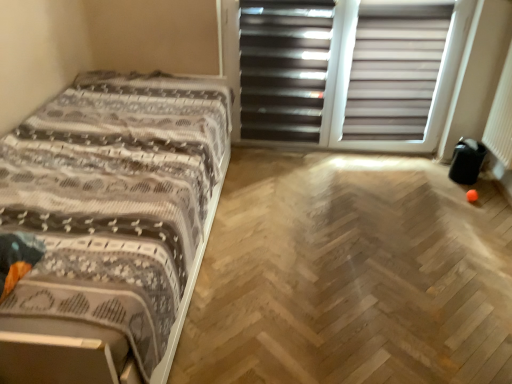
The width and height of the screenshot is (512, 384). Find the location of `matte white blinds at upper right`. matte white blinds at upper right is located at coordinates (394, 71).

Image resolution: width=512 pixels, height=384 pixels. Describe the element at coordinates (283, 68) in the screenshot. I see `black matte screen door at upper center, the 1th screen door positioned from the left` at that location.

In order to face patterned fabric bed at left, should I rotate leftwards or rightwards?

Rotate left and turn 18.602 degrees.

Measure the distance between point (149, 378) and camera.

Point (149, 378) and camera are 1.27 meters apart.

Image resolution: width=512 pixels, height=384 pixels. What do you see at coordinates (348, 72) in the screenshot? I see `white plastic blinds at upper center, arranged as the first screen door when viewed from the right` at bounding box center [348, 72].

The height and width of the screenshot is (384, 512). I want to click on matte white blinds at upper right, so click(394, 71).

Is patterned fabric bed at left aimed at matte white blinds at upper right?

No, patterned fabric bed at left is not aimed at matte white blinds at upper right.

Would you say patterned fabric bed at left is inside or outside matte white blinds at upper right?

patterned fabric bed at left is not inside matte white blinds at upper right, it's outside.

Considering the sizes of objects patterned fabric bed at left and matte white blinds at upper right in the image provided, who is wider, patterned fabric bed at left or matte white blinds at upper right?

patterned fabric bed at left is wider.

From a real-world perspective, is patterned fabric bed at left below matte white blinds at upper right?

Yes.

Is white plastic blinds at upper center, arranged as the first screen door when viewed from the right, to the left or to the right of black matte screen door at upper center, the 1th screen door positioned from the left, in the image?

white plastic blinds at upper center, arranged as the first screen door when viewed from the right, is to the right of black matte screen door at upper center, the 1th screen door positioned from the left.

From the image's perspective, is white plastic blinds at upper center, arranged as the first screen door when viewed from the right, below black matte screen door at upper center, which ranks as the 2th screen door in right-to-left order?

Yes.

Considering the sizes of objects white plastic blinds at upper center, the 2th screen door when ordered from left to right, and black matte screen door at upper center, which ranks as the 2th screen door in right-to-left order, in the image provided, who is shorter, white plastic blinds at upper center, the 2th screen door when ordered from left to right, or black matte screen door at upper center, which ranks as the 2th screen door in right-to-left order,?

With less height is black matte screen door at upper center, which ranks as the 2th screen door in right-to-left order.

Is white plastic blinds at upper center, arranged as the first screen door when viewed from the right, bigger than black matte screen door at upper center, the 1th screen door positioned from the left?

Yes, white plastic blinds at upper center, arranged as the first screen door when viewed from the right, is bigger than black matte screen door at upper center, the 1th screen door positioned from the left.

The image size is (512, 384). I want to click on window located above the patterned fabric bed at left (from a real-world perspective), so click(394, 71).

Is matte white blinds at upper right facing away from patterned fabric bed at left?

No, matte white blinds at upper right's orientation is not away from patterned fabric bed at left.

Based on the photo, which object is positioned more to the right, matte white blinds at upper right or patterned fabric bed at left?

matte white blinds at upper right is more to the right.

From the image's perspective, does matte white blinds at upper right appear lower than patterned fabric bed at left?

No, from the image's perspective, matte white blinds at upper right is not beneath patterned fabric bed at left.

Who is smaller, black matte screen door at upper center, which ranks as the 2th screen door in right-to-left order, or patterned fabric bed at left?

Smaller between the two is black matte screen door at upper center, which ranks as the 2th screen door in right-to-left order.

From a real-world perspective, between black matte screen door at upper center, the 1th screen door positioned from the left, and patterned fabric bed at left, who is vertically lower?

patterned fabric bed at left, from a real-world perspective.

Is black matte screen door at upper center, the 1th screen door positioned from the left, shorter than patterned fabric bed at left?

In fact, black matte screen door at upper center, the 1th screen door positioned from the left, may be taller than patterned fabric bed at left.

From the picture: Could you measure the distance between black matte screen door at upper center, which ranks as the 2th screen door in right-to-left order, and patterned fabric bed at left?

They are 37.93 inches apart.

From the picture: Is patterned fabric bed at left completely or partially outside of black matte screen door at upper center, which ranks as the 2th screen door in right-to-left order?

Absolutely, patterned fabric bed at left is external to black matte screen door at upper center, which ranks as the 2th screen door in right-to-left order.

Can you see patterned fabric bed at left touching black matte screen door at upper center, which ranks as the 2th screen door in right-to-left order?

No, patterned fabric bed at left is not next to black matte screen door at upper center, which ranks as the 2th screen door in right-to-left order.

From the image's perspective, who appears lower, patterned fabric bed at left or black matte screen door at upper center, the 1th screen door positioned from the left?

patterned fabric bed at left is shown below in the image.

Is patterned fabric bed at left oriented away from white plastic blinds at upper center, arranged as the first screen door when viewed from the right?

No, patterned fabric bed at left is not facing the opposite direction of white plastic blinds at upper center, arranged as the first screen door when viewed from the right.

Is patterned fabric bed at left next to white plastic blinds at upper center, the 2th screen door when ordered from left to right?

No, patterned fabric bed at left is not in contact with white plastic blinds at upper center, the 2th screen door when ordered from left to right.

How different are the orientations of patterned fabric bed at left and white plastic blinds at upper center, arranged as the first screen door when viewed from the right, in degrees?

The angular difference between patterned fabric bed at left and white plastic blinds at upper center, arranged as the first screen door when viewed from the right, is 1.65 degrees.

Considering the positions of objects patterned fabric bed at left and white plastic blinds at upper center, arranged as the first screen door when viewed from the right, in the image provided, who is more to the right, patterned fabric bed at left or white plastic blinds at upper center, arranged as the first screen door when viewed from the right,?

white plastic blinds at upper center, arranged as the first screen door when viewed from the right, is more to the right.

Is black matte screen door at upper center, the 1th screen door positioned from the left, in front of or behind white plastic blinds at upper center, arranged as the first screen door when viewed from the right, in the image?

black matte screen door at upper center, the 1th screen door positioned from the left, is behind white plastic blinds at upper center, arranged as the first screen door when viewed from the right.

Considering the points (270, 67) and (263, 128), which point is behind, point (270, 67) or point (263, 128)?

The point (263, 128) is more distant.

Considering the sizes of black matte screen door at upper center, which ranks as the 2th screen door in right-to-left order, and white plastic blinds at upper center, the 2th screen door when ordered from left to right, in the image, is black matte screen door at upper center, which ranks as the 2th screen door in right-to-left order, wider or thinner than white plastic blinds at upper center, the 2th screen door when ordered from left to right,?

In the image, black matte screen door at upper center, which ranks as the 2th screen door in right-to-left order, appears to be wider than white plastic blinds at upper center, the 2th screen door when ordered from left to right.

How distant is black matte screen door at upper center, which ranks as the 2th screen door in right-to-left order, from white plastic blinds at upper center, arranged as the first screen door when viewed from the right?

The distance of black matte screen door at upper center, which ranks as the 2th screen door in right-to-left order, from white plastic blinds at upper center, arranged as the first screen door when viewed from the right, is 5.85 inches.

The height and width of the screenshot is (384, 512). I want to click on window on the right side of patterned fabric bed at left, so click(x=394, y=71).

Locate an element on the screen. screen door above the white plastic blinds at upper center, the 2th screen door when ordered from left to right (from a real-world perspective) is located at coordinates (283, 68).

Based on their spatial positions, is white plastic blinds at upper center, arranged as the first screen door when viewed from the right, or patterned fabric bed at left further from matte white blinds at upper right?

patterned fabric bed at left is further to matte white blinds at upper right.

Which object lies nearer to the anchor point black matte screen door at upper center, which ranks as the 2th screen door in right-to-left order, white plastic blinds at upper center, arranged as the first screen door when viewed from the right, or patterned fabric bed at left?

white plastic blinds at upper center, arranged as the first screen door when viewed from the right, is positioned closer to the anchor black matte screen door at upper center, which ranks as the 2th screen door in right-to-left order.

Considering their positions, is black matte screen door at upper center, which ranks as the 2th screen door in right-to-left order, positioned further to patterned fabric bed at left than white plastic blinds at upper center, the 2th screen door when ordered from left to right?

Based on the image, white plastic blinds at upper center, the 2th screen door when ordered from left to right, appears to be further to patterned fabric bed at left.

From the image, which object appears to be nearer to black matte screen door at upper center, the 1th screen door positioned from the left, matte white blinds at upper right or white plastic blinds at upper center, the 2th screen door when ordered from left to right?

white plastic blinds at upper center, the 2th screen door when ordered from left to right, lies closer to black matte screen door at upper center, the 1th screen door positioned from the left, than the other object.

When comparing their distances from black matte screen door at upper center, which ranks as the 2th screen door in right-to-left order, does patterned fabric bed at left or white plastic blinds at upper center, the 2th screen door when ordered from left to right, seem closer?

Among the two, white plastic blinds at upper center, the 2th screen door when ordered from left to right, is located nearer to black matte screen door at upper center, which ranks as the 2th screen door in right-to-left order.

Which object lies further to the anchor point patterned fabric bed at left, matte white blinds at upper right or black matte screen door at upper center, the 1th screen door positioned from the left?

matte white blinds at upper right is positioned further to the anchor patterned fabric bed at left.

Consider the image. Looking at the image, which one is located further to white plastic blinds at upper center, arranged as the first screen door when viewed from the right, matte white blinds at upper right or black matte screen door at upper center, which ranks as the 2th screen door in right-to-left order?

Among the two, black matte screen door at upper center, which ranks as the 2th screen door in right-to-left order, is located further to white plastic blinds at upper center, arranged as the first screen door when viewed from the right.

Looking at the image, which one is located closer to matte white blinds at upper right, patterned fabric bed at left or black matte screen door at upper center, the 1th screen door positioned from the left?

Based on the image, black matte screen door at upper center, the 1th screen door positioned from the left, appears to be nearer to matte white blinds at upper right.

Locate an element on the screen. The image size is (512, 384). screen door positioned between patterned fabric bed at left and black matte screen door at upper center, the 1th screen door positioned from the left, from near to far is located at coordinates (348, 72).

Find the location of a particular element. The height and width of the screenshot is (384, 512). window located between patterned fabric bed at left and black matte screen door at upper center, which ranks as the 2th screen door in right-to-left order, in the depth direction is located at coordinates (394, 71).

You are a GUI agent. You are given a task and a screenshot of the screen. Output one action in this format:
    pyautogui.click(x=<x>, y=<y>)
    Task: Click on the screen door between black matte screen door at upper center, which ranks as the 2th screen door in right-to-left order, and matte white blinds at upper right from left to right
    
    Given the screenshot: What is the action you would take?
    pyautogui.click(x=348, y=72)

Identify the location of window between patterned fabric bed at left and white plastic blinds at upper center, arranged as the first screen door when viewed from the right, along the z-axis. (394, 71).